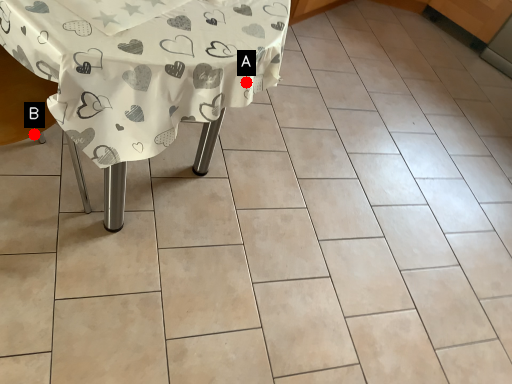
Question: Two points are circled on the image, labeled by A and B beside each circle. Which point appears farthest from the camera in this image?

Choices:
 (A) A is further
 (B) B is further

Answer: (B)